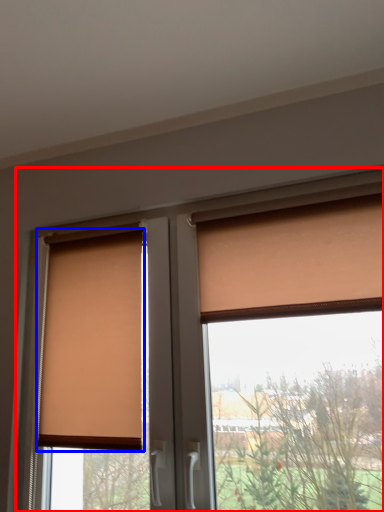
Question: Which of the following is the closest to the observer, window (highlighted by a red box) or window blind (highlighted by a blue box)?

Choices:
 (A) window
 (B) window blind

Answer: (A)